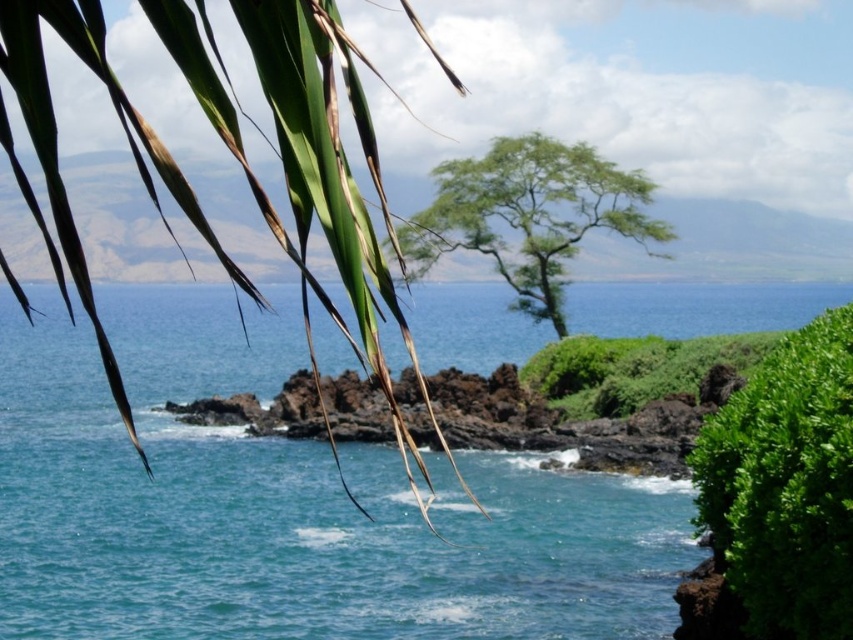
Question: Which point is farther to the camera?

Choices:
 (A) (312, 104)
 (B) (790, 401)
 (C) (154, 348)
 (D) (553, 307)

Answer: (C)

Question: Can you confirm if green leafy palm tree at upper left is positioned to the left of green leafy bush at lower right?

Choices:
 (A) no
 (B) yes

Answer: (B)

Question: Which object is the farthest from the green leafy tree at center?

Choices:
 (A) green leafy bush at lower right
 (B) clear blue water at center
 (C) green leafy palm tree at upper left

Answer: (A)

Question: Based on their relative distances, which object is farther from the green leafy palm tree at upper left?

Choices:
 (A) green leafy bush at lower right
 (B) green leafy tree at center

Answer: (B)

Question: Does clear blue water at center have a lesser width compared to green leafy tree at center?

Choices:
 (A) no
 (B) yes

Answer: (A)

Question: Does green leafy palm tree at upper left appear on the right side of green leafy tree at center?

Choices:
 (A) no
 (B) yes

Answer: (A)